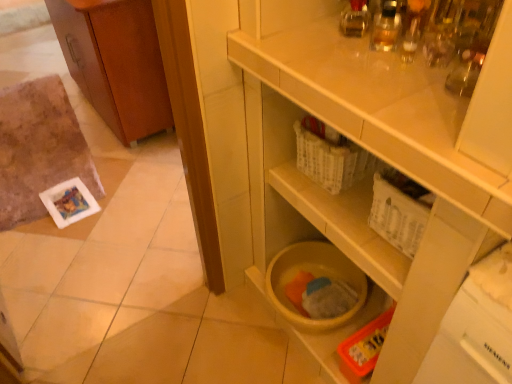
Question: Which is correct: yellow matte plastic bucket at lower center is inside wooden cabinet at left, or outside of it?

Choices:
 (A) inside
 (B) outside

Answer: (B)

Question: Looking at their shapes, would you say yellow matte plastic bucket at lower center is wider or thinner than wooden cabinet at left?

Choices:
 (A) wide
 (B) thin

Answer: (A)

Question: Estimate the real-world distances between objects in this image. Which object is closer to the wooden cabinet at left?

Choices:
 (A) yellow matte plastic bucket at lower center
 (B) white plastic drawer at upper right

Answer: (A)

Question: Which is nearer to the white plastic drawer at upper right?

Choices:
 (A) yellow matte plastic bucket at lower center
 (B) wooden cabinet at left

Answer: (A)